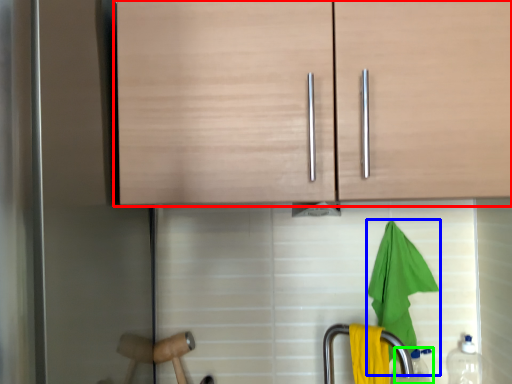
Question: Based on their relative distances, which object is farther from cabinetry (highlighted by a red box)? Choose from beach towel (highlighted by a blue box) and bottle (highlighted by a green box).

Choices:
 (A) beach towel
 (B) bottle

Answer: (B)